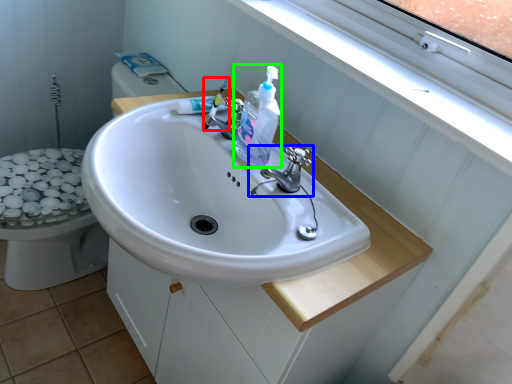
Question: Considering the real-world distances, which object is closest to toothbrush (highlighted by a red box)? tap (highlighted by a blue box) or cleaning product (highlighted by a green box).

Choices:
 (A) tap
 (B) cleaning product

Answer: (B)